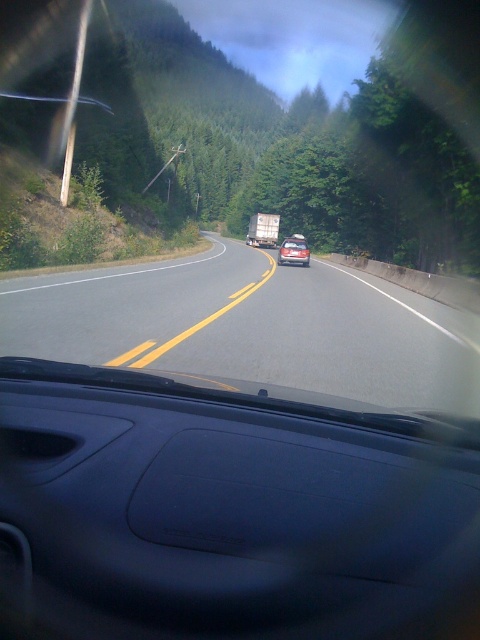
You are sitting in the passenger seat of a car and want to reach a point marked at coordinates point (348,584) on the road ahead. If your arm can reach 6 feet, can you touch that point?

The distance of point (348,584) from viewer is 8.10 feet, so no, you cannot touch it because it is farther than your arm can reach.

You are driving and see two points on the road ahead. The first point is at coordinates point (272, 424) and the second point is at point (254, 230). Which point is closer to your car?

Point (272, 424) is closer to the viewer than point (254, 230).

You are a passenger in a car and want to look at the road ahead through the transparent plastic car window at center. Can you see the smooth asphalt road at center through it?

The transparent plastic car window at center is located below the smooth asphalt road at center, so yes, you can see the smooth asphalt road at center through the transparent plastic car window at center because it is positioned directly beneath it.